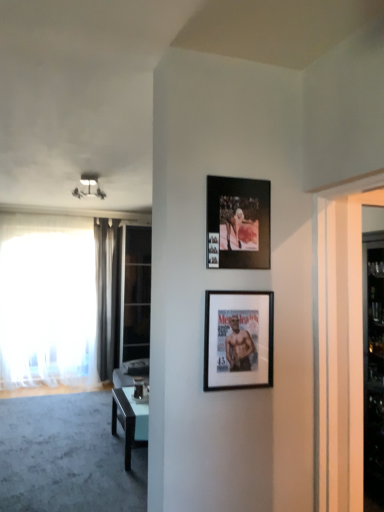
Question: From a real-world perspective, is matte white light fixture at upper left positioned under black matte picture frame at center, placed as the 1th picture frame when sorted from bottom to top, based on gravity?

Choices:
 (A) no
 (B) yes

Answer: (A)

Question: Is matte white light fixture at upper left at the right side of black matte picture frame at center, arranged as the second picture frame when viewed from the top?

Choices:
 (A) yes
 (B) no

Answer: (B)

Question: Is matte white light fixture at upper left bigger than black matte picture frame at center, placed as the 1th picture frame when sorted from bottom to top?

Choices:
 (A) yes
 (B) no

Answer: (A)

Question: Can you confirm if matte white light fixture at upper left is wider than black matte picture frame at center, arranged as the second picture frame when viewed from the top?

Choices:
 (A) yes
 (B) no

Answer: (A)

Question: Is black matte picture frame at center, arranged as the second picture frame when viewed from the top, surrounded by matte white light fixture at upper left?

Choices:
 (A) yes
 (B) no

Answer: (B)

Question: Is matte white light fixture at upper left oriented towards black matte picture frame at center, placed as the 1th picture frame when sorted from bottom to top?

Choices:
 (A) yes
 (B) no

Answer: (B)

Question: Is white glass door at right positioned beyond the bounds of matte white light fixture at upper left?

Choices:
 (A) yes
 (B) no

Answer: (A)

Question: Is white glass door at right oriented away from matte white light fixture at upper left?

Choices:
 (A) no
 (B) yes

Answer: (A)

Question: From a real-world perspective, is white glass door at right located beneath matte white light fixture at upper left?

Choices:
 (A) no
 (B) yes

Answer: (B)

Question: From the image's perspective, is white glass door at right over matte white light fixture at upper left?

Choices:
 (A) yes
 (B) no

Answer: (B)

Question: From the image's perspective, is white glass door at right below matte white light fixture at upper left?

Choices:
 (A) no
 (B) yes

Answer: (B)

Question: Is white glass door at right bigger than matte white light fixture at upper left?

Choices:
 (A) yes
 (B) no

Answer: (A)

Question: Does black matte picture frame at upper center, which appears as the 2th picture frame when ordered from the bottom, appear on the right side of transparent glass door at left?

Choices:
 (A) yes
 (B) no

Answer: (A)